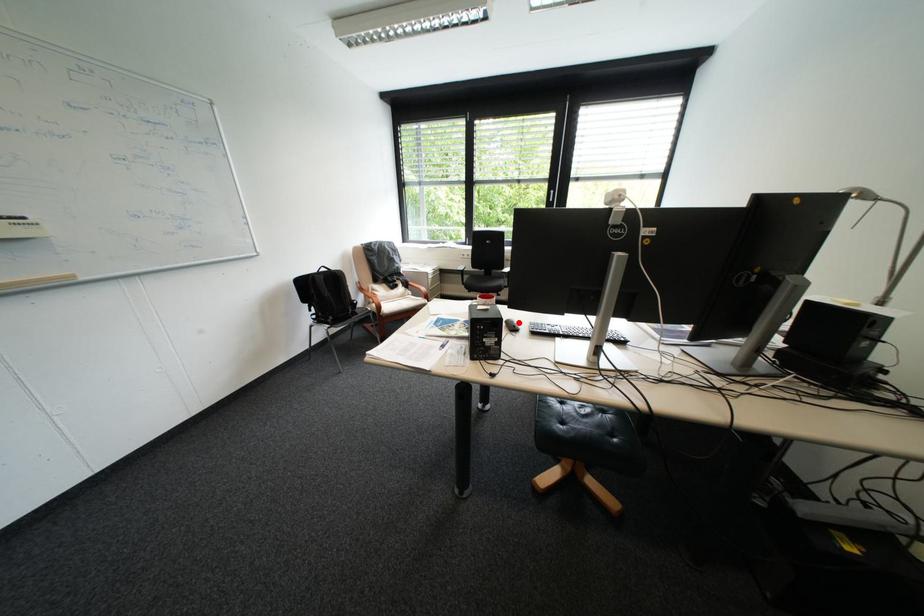
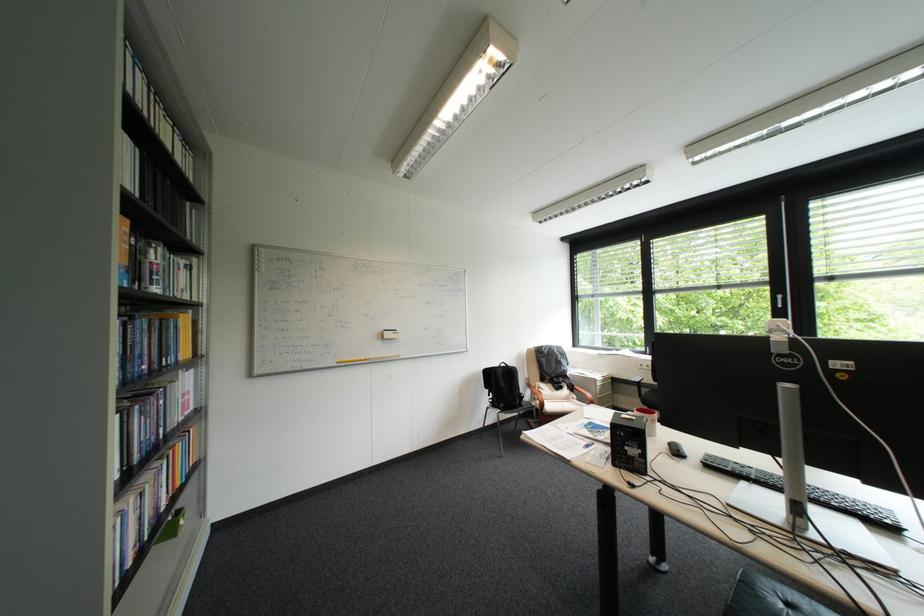
Question: I am providing you with two images of the same scene from different viewpoints. Image1 has a red point marked. In image2, the corresponding 3D location appears at what relative position? Reply with the corresponding letter.

Choices:
 (A) Closer
 (B) Farther

Answer: (A)